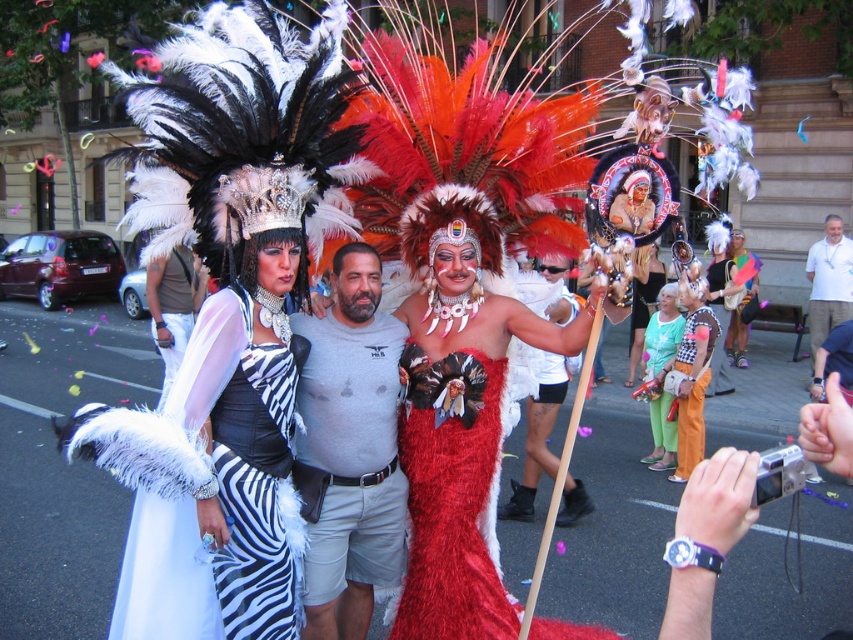
Does velvet orange dress at center lie in front of velvet orange skirt at center?

Yes.

Is velvet orange dress at center wider than velvet orange skirt at center?

No.

Which is in front, point (688, 408) or point (722, 388)?

Point (688, 408) is more forward.

Identify the location of velvet orange dress at center. (689, 419).

Does point (811, 301) come behind point (709, 268)?

No, (811, 301) is closer to viewer.

Which is in front, point (809, 346) or point (706, 268)?

Point (809, 346)

Measure the distance between white cotton shirt at center and camera.

white cotton shirt at center and camera are 10.89 meters apart.

I want to click on white cotton shirt at center, so click(x=828, y=282).

Who is more distant from viewer, (328, 577) or (556, 465)?

The point (556, 465) is behind.

This screenshot has width=853, height=640. I want to click on gray cotton shirt at center, so click(350, 451).

Is point (366, 432) positioned in front of point (527, 452)?

That is True.

This screenshot has height=640, width=853. I want to click on gray cotton shirt at center, so click(350, 451).